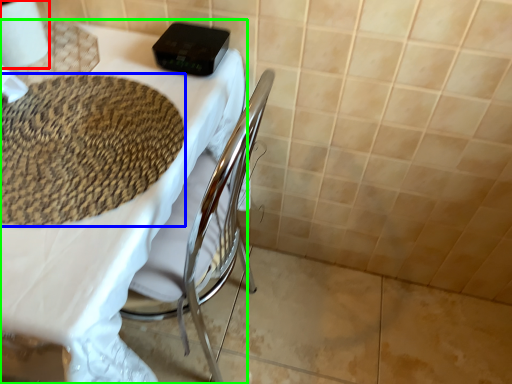
Question: Estimate the real-world distances between objects in this image. Which object is closer to toilet paper (highlighted by a red box), mat (highlighted by a blue box) or table (highlighted by a green box)?

Choices:
 (A) mat
 (B) table

Answer: (A)